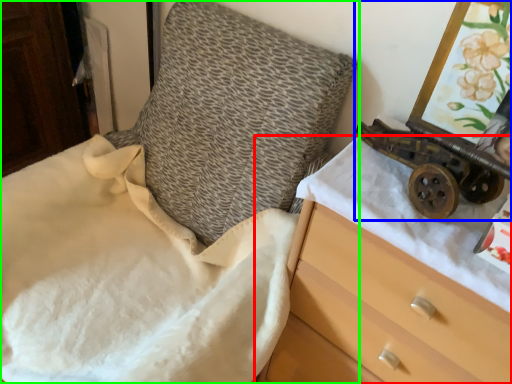
Question: Based on their relative distances, which object is nearer to chest of drawers (highlighted by a red box)? Choose from toy (highlighted by a blue box) and furniture (highlighted by a green box).

Choices:
 (A) toy
 (B) furniture

Answer: (A)